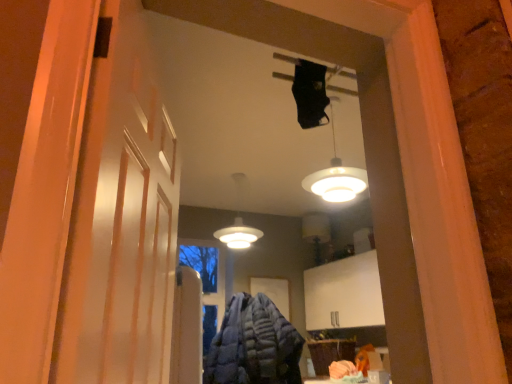
What do you see at coordinates (254, 345) in the screenshot?
I see `blue quilted jacket at center` at bounding box center [254, 345].

Where is `white glossy lampshade at upper center, the 1th lamp positioned from the right`? The width and height of the screenshot is (512, 384). white glossy lampshade at upper center, the 1th lamp positioned from the right is located at coordinates (336, 178).

Which is in front, blue quilted jacket at center or white glossy lampshade at upper center, the 1th lamp positioned from the right?

white glossy lampshade at upper center, the 1th lamp positioned from the right, is closer to the camera.

Is blue quilted jacket at center wider or thinner than white glossy lampshade at upper center, which appears as the second lamp when viewed from the left?

Clearly, blue quilted jacket at center has more width compared to white glossy lampshade at upper center, which appears as the second lamp when viewed from the left.

Is blue quilted jacket at center positioned with its back to white glossy lampshade at upper center, positioned as the second lamp in back-to-front order?

No.

Locate an element on the screen. This screenshot has width=512, height=384. clothing below the white glossy lampshade at upper center, the 1th lamp positioned from the right (from the image's perspective) is located at coordinates (254, 345).

Can you confirm if white matte lamp at center, marked as the 2th lamp in a right-to-left arrangement, is taller than white glossy lampshade at upper center, positioned as the second lamp in back-to-front order?

Indeed, white matte lamp at center, marked as the 2th lamp in a right-to-left arrangement, has a greater height compared to white glossy lampshade at upper center, positioned as the second lamp in back-to-front order.

Considering the relative sizes of white matte lamp at center, acting as the second lamp starting from the front, and white glossy lampshade at upper center, which appears as the second lamp when viewed from the left, in the image provided, is white matte lamp at center, acting as the second lamp starting from the front, smaller than white glossy lampshade at upper center, which appears as the second lamp when viewed from the left,?

Actually, white matte lamp at center, acting as the second lamp starting from the front, might be larger than white glossy lampshade at upper center, which appears as the second lamp when viewed from the left.

From the image's perspective, which object appears higher, white matte lamp at center, the first lamp when ordered from left to right, or white glossy lampshade at upper center, positioned as the second lamp in back-to-front order?

white glossy lampshade at upper center, positioned as the second lamp in back-to-front order, appears higher in the image.

Is blue quilted jacket at center with white matte barn door at left?

No.

From a real-world perspective, between blue quilted jacket at center and white matte barn door at left, who is vertically higher?

In real-world perspective, white matte barn door at left is above.

Based on their sizes in the image, would you say blue quilted jacket at center is bigger or smaller than white matte barn door at left?

blue quilted jacket at center is bigger than white matte barn door at left.

Is blue quilted jacket at center looking in the opposite direction of white matte barn door at left?

No.

Considering the positions of objects white glossy lampshade at upper center, the 1th lamp positioned from the right, and white matte barn door at left in the image provided, who is behind, white glossy lampshade at upper center, the 1th lamp positioned from the right, or white matte barn door at left?

white glossy lampshade at upper center, the 1th lamp positioned from the right.

Is white glossy lampshade at upper center, which appears as the second lamp when viewed from the left, wider or thinner than white matte barn door at left?

Clearly, white glossy lampshade at upper center, which appears as the second lamp when viewed from the left, has more width compared to white matte barn door at left.

From the image's perspective, which object appears higher, white glossy lampshade at upper center, which appears as the second lamp when viewed from the left, or white matte barn door at left?

white glossy lampshade at upper center, which appears as the second lamp when viewed from the left, appears higher in the image.

Consider the image. Is white matte barn door at left completely or partially inside white glossy lampshade at upper center, arranged as the first lamp when viewed from the front?

No.

Is white glossy lampshade at upper center, positioned as the second lamp in back-to-front order, facing towards white matte lamp at center, acting as the second lamp starting from the front?

No, white glossy lampshade at upper center, positioned as the second lamp in back-to-front order, does not turn towards white matte lamp at center, acting as the second lamp starting from the front.

This screenshot has width=512, height=384. I want to click on lamp to the left of white glossy lampshade at upper center, the 1th lamp positioned from the right, so click(x=239, y=222).

Between white glossy lampshade at upper center, the 1th lamp positioned from the right, and white matte lamp at center, acting as the second lamp starting from the front, which one has larger width?

white matte lamp at center, acting as the second lamp starting from the front, is wider.

How different are the orientations of white glossy lampshade at upper center, positioned as the second lamp in back-to-front order, and white matte lamp at center, marked as the first lamp in a back-to-front arrangement, in degrees?

The angular difference between white glossy lampshade at upper center, positioned as the second lamp in back-to-front order, and white matte lamp at center, marked as the first lamp in a back-to-front arrangement, is 0.0997 degrees.

Is white glossy lampshade at upper center, positioned as the second lamp in back-to-front order, at the left side of blue quilted jacket at center?

No.

How much distance is there between white glossy lampshade at upper center, the 1th lamp positioned from the right, and blue quilted jacket at center?

4.73 feet.

From a real-world perspective, which is physically above, white glossy lampshade at upper center, which appears as the second lamp when viewed from the left, or blue quilted jacket at center?

In real-world perspective, white glossy lampshade at upper center, which appears as the second lamp when viewed from the left, is above.

How many degrees apart are the facing directions of white glossy lampshade at upper center, positioned as the second lamp in back-to-front order, and blue quilted jacket at center?

white glossy lampshade at upper center, positioned as the second lamp in back-to-front order, and blue quilted jacket at center are facing 3 degrees away from each other.

Are white matte barn door at left and white glossy lampshade at upper center, arranged as the first lamp when viewed from the front, making contact?

No.

Is white glossy lampshade at upper center, the 1th lamp positioned from the right, at the back of white matte barn door at left?

No, white matte barn door at left is not facing the opposite direction of white glossy lampshade at upper center, the 1th lamp positioned from the right.

Can you confirm if white matte barn door at left is bigger than white glossy lampshade at upper center, the 1th lamp positioned from the right?

No.

From the image's perspective, which one is positioned lower, white matte barn door at left or white glossy lampshade at upper center, the 1th lamp positioned from the right?

white matte barn door at left is shown below in the image.

At what (x,y) coordinates should I click in order to perform the action: click on clothing beneath the white glossy lampshade at upper center, the 1th lamp positioned from the right (from a real-world perspective). Please return your answer as a coordinate pair (x, y). Looking at the image, I should click on (254, 345).

Where is `lamp located behind the white glossy lampshade at upper center, which appears as the second lamp when viewed from the left`? This screenshot has height=384, width=512. lamp located behind the white glossy lampshade at upper center, which appears as the second lamp when viewed from the left is located at coordinates (239, 222).

Considering their positions, is white glossy lampshade at upper center, the 1th lamp positioned from the right, positioned closer to white matte barn door at left than blue quilted jacket at center?

Based on the image, white glossy lampshade at upper center, the 1th lamp positioned from the right, appears to be nearer to white matte barn door at left.

Considering their positions, is white glossy lampshade at upper center, arranged as the first lamp when viewed from the front, positioned closer to white matte lamp at center, the first lamp when ordered from left to right, than blue quilted jacket at center?

The object closer to white matte lamp at center, the first lamp when ordered from left to right, is blue quilted jacket at center.

Estimate the real-world distances between objects in this image. Which object is closer to white matte lamp at center, marked as the 2th lamp in a right-to-left arrangement, white glossy lampshade at upper center, positioned as the second lamp in back-to-front order, or white matte barn door at left?

white glossy lampshade at upper center, positioned as the second lamp in back-to-front order.

Based on their spatial positions, is blue quilted jacket at center or white glossy lampshade at upper center, the 1th lamp positioned from the right, closer to white matte lamp at center, the first lamp when ordered from left to right?

The object closer to white matte lamp at center, the first lamp when ordered from left to right, is blue quilted jacket at center.

When comparing their distances from blue quilted jacket at center, does white glossy lampshade at upper center, positioned as the second lamp in back-to-front order, or white matte lamp at center, marked as the first lamp in a back-to-front arrangement, seem further?

The object further to blue quilted jacket at center is white glossy lampshade at upper center, positioned as the second lamp in back-to-front order.

When comparing their distances from white matte lamp at center, marked as the first lamp in a back-to-front arrangement, does white matte barn door at left or blue quilted jacket at center seem closer?

Based on the image, blue quilted jacket at center appears to be nearer to white matte lamp at center, marked as the first lamp in a back-to-front arrangement.

When comparing their distances from white glossy lampshade at upper center, positioned as the second lamp in back-to-front order, does white matte barn door at left or white matte lamp at center, marked as the 2th lamp in a right-to-left arrangement, seem further?

white matte barn door at left is positioned further to the anchor white glossy lampshade at upper center, positioned as the second lamp in back-to-front order.

Looking at the image, which one is located further to white glossy lampshade at upper center, which appears as the second lamp when viewed from the left, blue quilted jacket at center or white matte barn door at left?

Based on the image, white matte barn door at left appears to be further to white glossy lampshade at upper center, which appears as the second lamp when viewed from the left.

Image resolution: width=512 pixels, height=384 pixels. Identify the location of lamp between white matte barn door at left and blue quilted jacket at center along the z-axis. (336, 178).

Find the location of a particular element. lamp between white glossy lampshade at upper center, arranged as the first lamp when viewed from the front, and blue quilted jacket at center, in the vertical direction is located at coordinates click(x=239, y=222).

Locate an element on the screen. lamp between white matte barn door at left and white matte lamp at center, the first lamp when ordered from left to right, along the z-axis is located at coordinates (336, 178).

Find the location of a particular element. The width and height of the screenshot is (512, 384). clothing between white matte barn door at left and white matte lamp at center, acting as the second lamp starting from the front, along the z-axis is located at coordinates (254, 345).